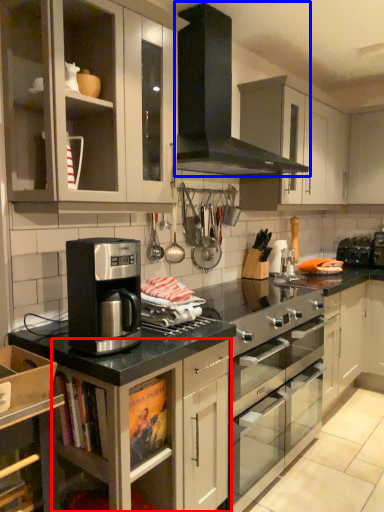
Question: Which object appears closest to the camera in this image, cabinetry (highlighted by a red box) or gas stove (highlighted by a blue box)?

Choices:
 (A) cabinetry
 (B) gas stove

Answer: (A)